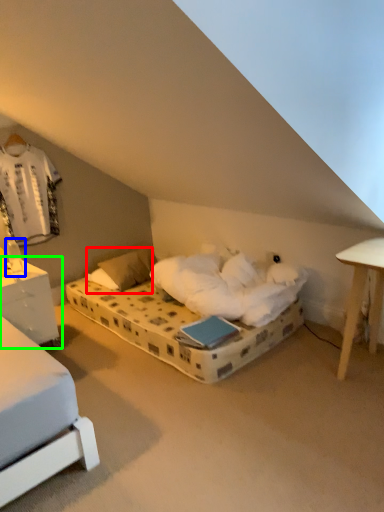
Question: Which is nearer to the pillow (highlighted by a red box)? table lamp (highlighted by a blue box) or nightstand (highlighted by a green box).

Choices:
 (A) table lamp
 (B) nightstand

Answer: (B)